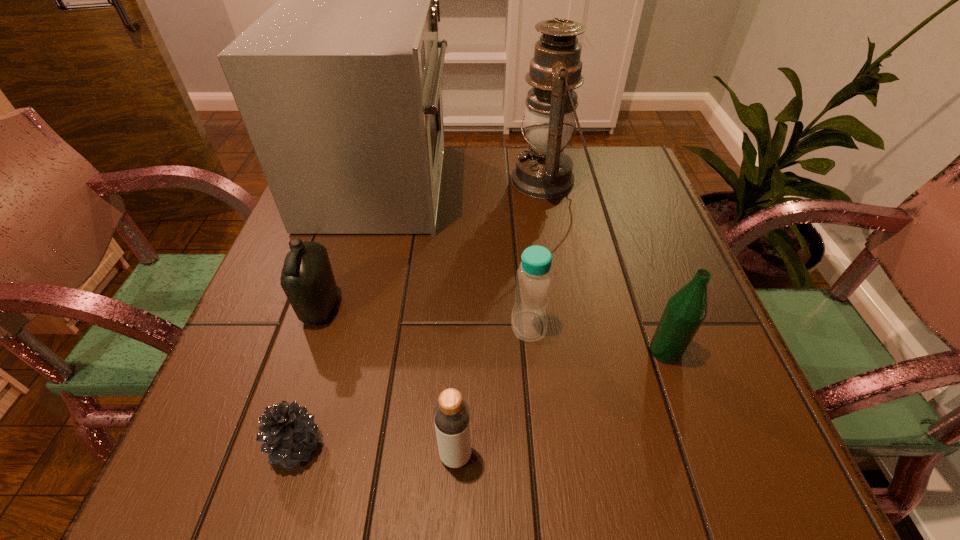
At what (x,y) coordinates should I click in order to perform the action: click on bottle that stands as the closest to the pinecone. Please return your answer as a coordinate pair (x, y). Looking at the image, I should click on (451, 414).

Select which bottle appears as the third closest to the leftmost bottle. Please provide its 2D coordinates. Your answer should be formatted as a tuple, i.e. [(x, y)], where the tuple contains the x and y coordinates of a point satisfying the conditions above.

[(685, 311)]

Where is `vacant space that satisfies the following two spatial constraints: 1. on the back side of the nearest bottle; 2. on the left side of the rightmost object`? The width and height of the screenshot is (960, 540). vacant space that satisfies the following two spatial constraints: 1. on the back side of the nearest bottle; 2. on the left side of the rightmost object is located at coordinates (460, 351).

Find the location of `vacant space that satisfies the following two spatial constraints: 1. on the front panel of the toaster oven; 2. on the back side of the rightmost object`. vacant space that satisfies the following two spatial constraints: 1. on the front panel of the toaster oven; 2. on the back side of the rightmost object is located at coordinates (335, 351).

The height and width of the screenshot is (540, 960). I want to click on vacant space that satisfies the following two spatial constraints: 1. on the front side of the leftmost bottle; 2. on the left side of the third bottle from left to right, so click(315, 326).

Find the location of a particular element. The height and width of the screenshot is (540, 960). vacant space that satisfies the following two spatial constraints: 1. on the front panel of the nearest bottle; 2. on the left side of the toaster oven is located at coordinates (307, 455).

Locate an element on the screen. The height and width of the screenshot is (540, 960). vacant space that satisfies the following two spatial constraints: 1. on the front side of the leftmost bottle; 2. on the left side of the pinecone is located at coordinates (276, 446).